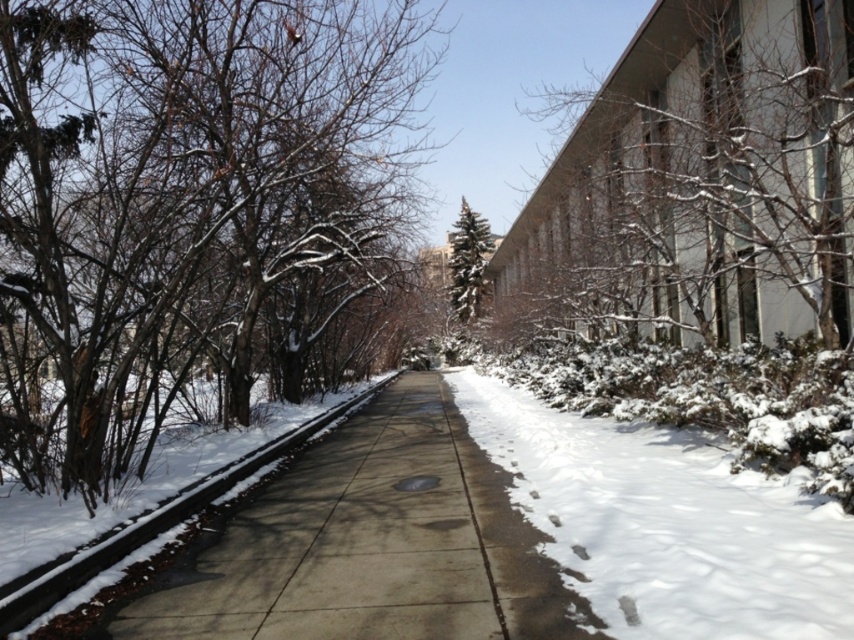
You are standing at the entrance of the building and want to walk towards the point marked as point (794, 362) and point (118, 560). Which point will you reach first?

You will reach point (794, 362) first because it is closer to you than point (118, 560), which is further away.

You are a delivery person trying to walk from the building on the right to the trees on the left. You see the white fluffy snow at center and the concrete at center. Which surface should you step on to avoid sinking into the snow?

You should step on the concrete at center because the white fluffy snow at center is to the right of it, meaning the concrete is likely under the snow and more solid for walking.